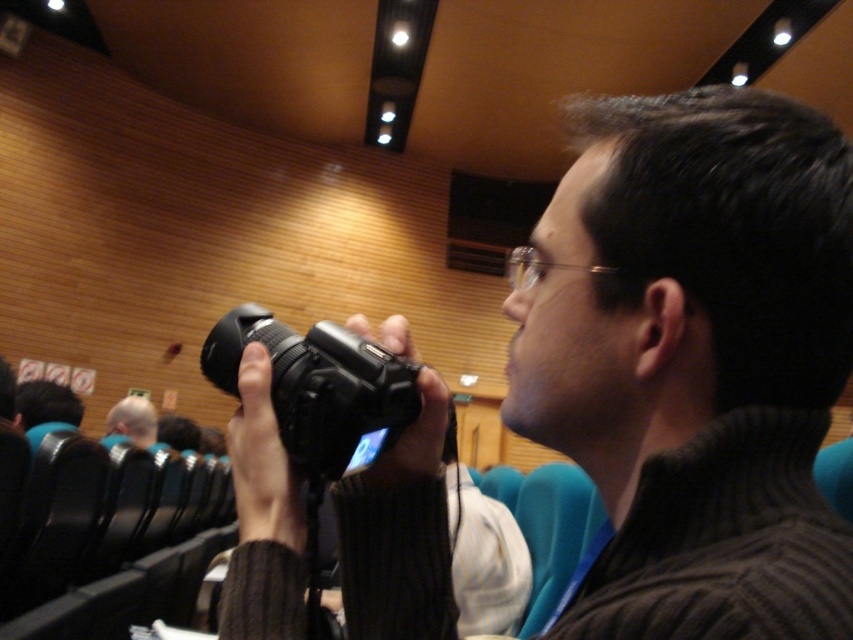
You are standing in the conference hall and want to take a photo of the black matte camera at center. Where should you position yourself to capture it in the frame?

The black matte camera at center is located at point 0.566 on the horizontal axis and 0.815 on the vertical axis. To capture it in your frame, position yourself directly in front of the coordinates provided.

You are organizing a photography workshop in the conference hall and have two cameras available for participants. The black matte camera at center and the black plastic camera at center are both placed on a table. If you want to choose the taller one for a demonstration, which camera should you pick?

The black matte camera at center is much taller than the black plastic camera at center, so you should pick the black matte camera at center for the demonstration.